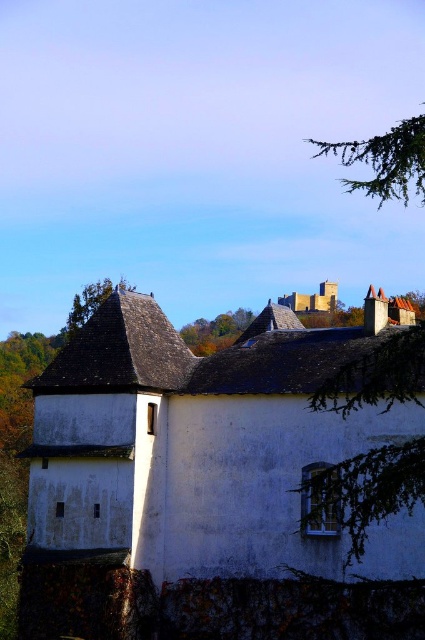
Is white matte stone castle at center above brown stone castle at upper center?

Incorrect, white matte stone castle at center is not positioned above brown stone castle at upper center.

Does point (252, 573) come closer to viewer compared to point (325, 292)?

Yes, it is.

Describe the element at coordinates (192, 444) in the screenshot. The width and height of the screenshot is (425, 640). I see `white matte stone castle at center` at that location.

At what (x,y) coordinates should I click in order to perform the action: click on white matte stone castle at center. Please return your answer as a coordinate pair (x, y). Looking at the image, I should click on (192, 444).

Consider the image. Between white matte stone castle at center and green needle-like leaves at upper right, which one has less height?

white matte stone castle at center is shorter.

Between white matte stone castle at center and green needle-like leaves at upper right, which one is positioned higher?

green needle-like leaves at upper right is above.

Is point (320, 456) farther from camera compared to point (390, 198)?

No.

At what (x,y) coordinates should I click in order to perform the action: click on white matte stone castle at center. Please return your answer as a coordinate pair (x, y). Looking at the image, I should click on (192, 444).

Between green needle-like leaves at upper right and green leafy tree at upper center, which one has more height?

green needle-like leaves at upper right

Is point (413, 134) positioned in front of point (184, 339)?

Yes, it is.

In order to click on green needle-like leaves at upper right in this screenshot , I will do `click(385, 161)`.